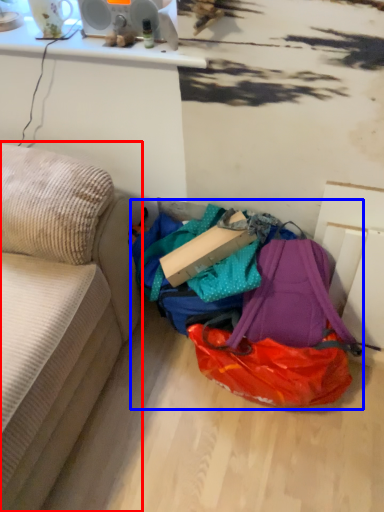
Question: Which object appears farthest to the camera in this image, studio couch (highlighted by a red box) or bag (highlighted by a blue box)?

Choices:
 (A) studio couch
 (B) bag

Answer: (B)